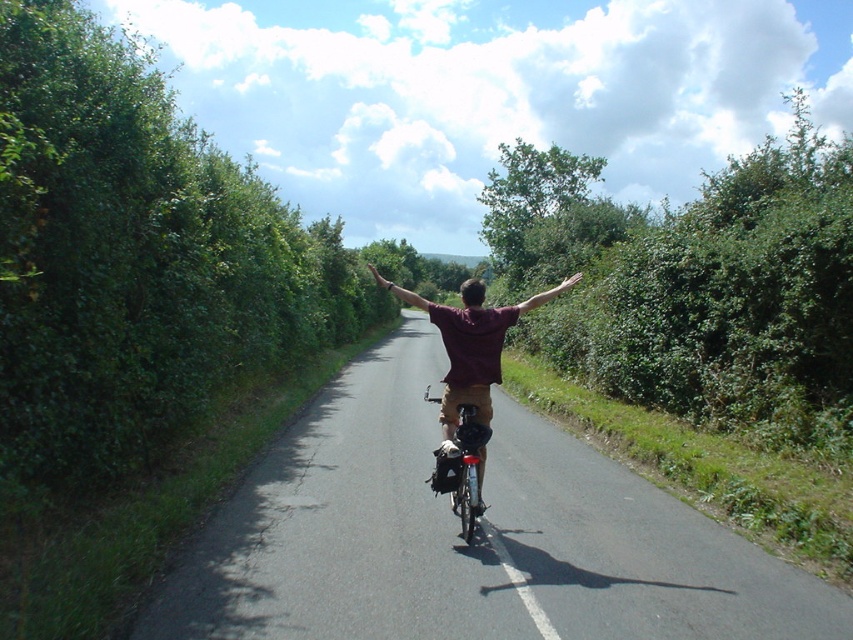
Is the position of brown leather arm at center less distant than that of brown leather hand at center?

Yes, it is.

Can you confirm if brown leather arm at center is smaller than brown leather hand at center?

No.

Between point (392, 291) and point (392, 282), which one is positioned behind?

Positioned behind is point (392, 282).

This screenshot has height=640, width=853. What are the coordinates of `brown leather arm at center` in the screenshot? It's located at (401, 291).

Is point (399, 291) farther from camera compared to point (578, 273)?

No, it is not.

Does brown leather arm at center appear under smooth skin hand at upper center?

No, brown leather arm at center is not below smooth skin hand at upper center.

Find the location of a particular element. The height and width of the screenshot is (640, 853). brown leather arm at center is located at coordinates (401, 291).

Between brown fabric arm at center and smooth skin hand at upper center, which one is positioned lower?

brown fabric arm at center is lower down.

Is point (550, 294) closer to camera compared to point (572, 278)?

Yes, point (550, 294) is closer to viewer.

Which is behind, point (556, 291) or point (556, 292)?

Positioned behind is point (556, 292).

The width and height of the screenshot is (853, 640). I want to click on brown fabric arm at center, so click(x=543, y=296).